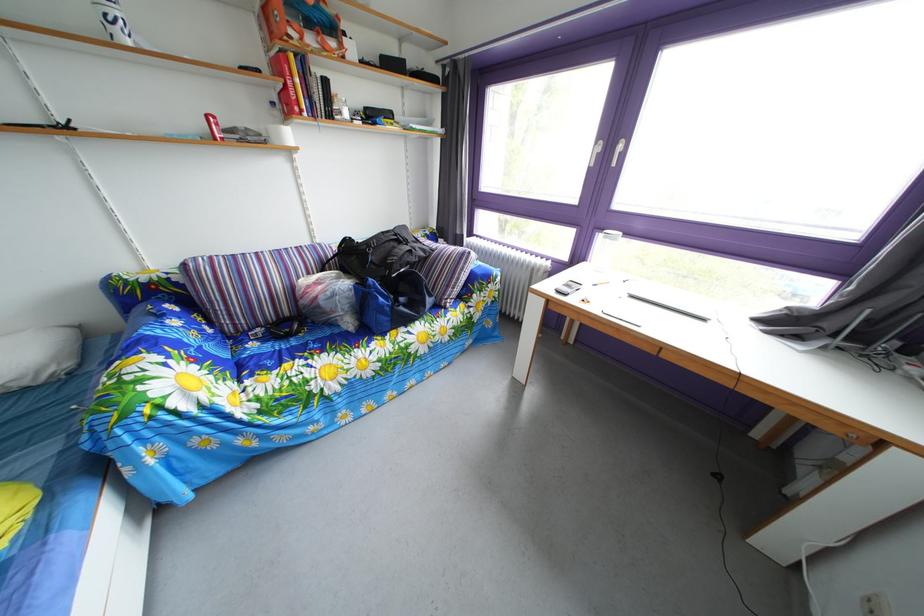
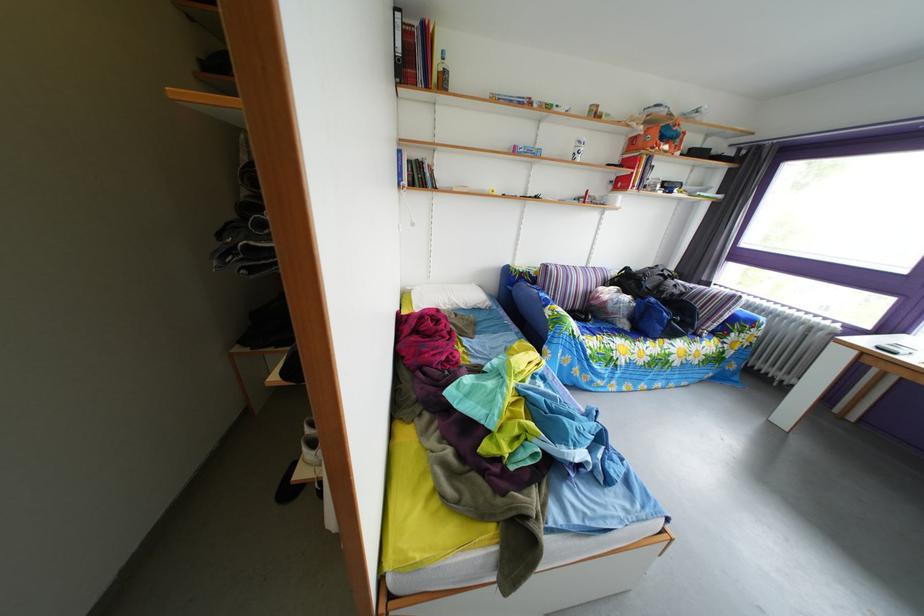
Locate, in the second image, the point that corresponds to [320,33] in the first image.

(673, 147)